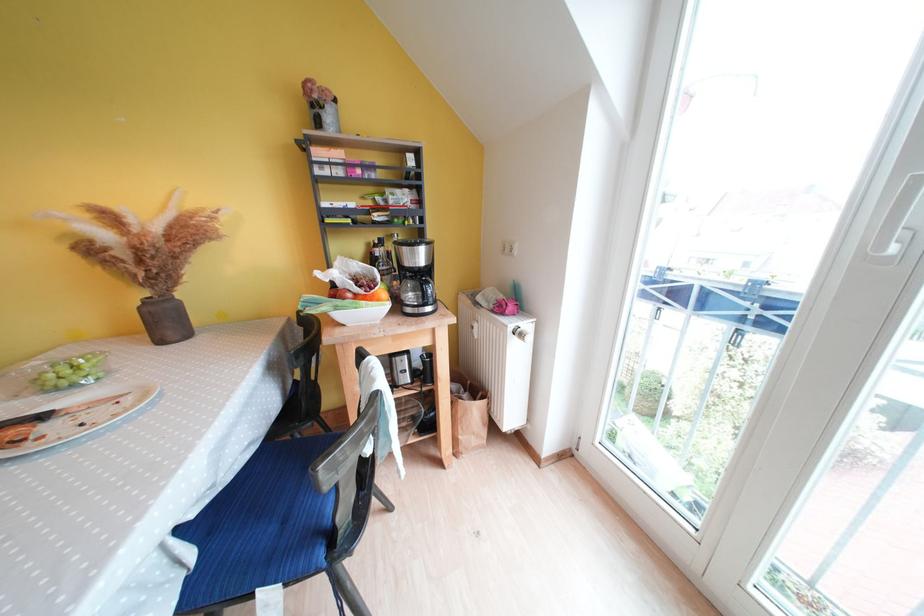
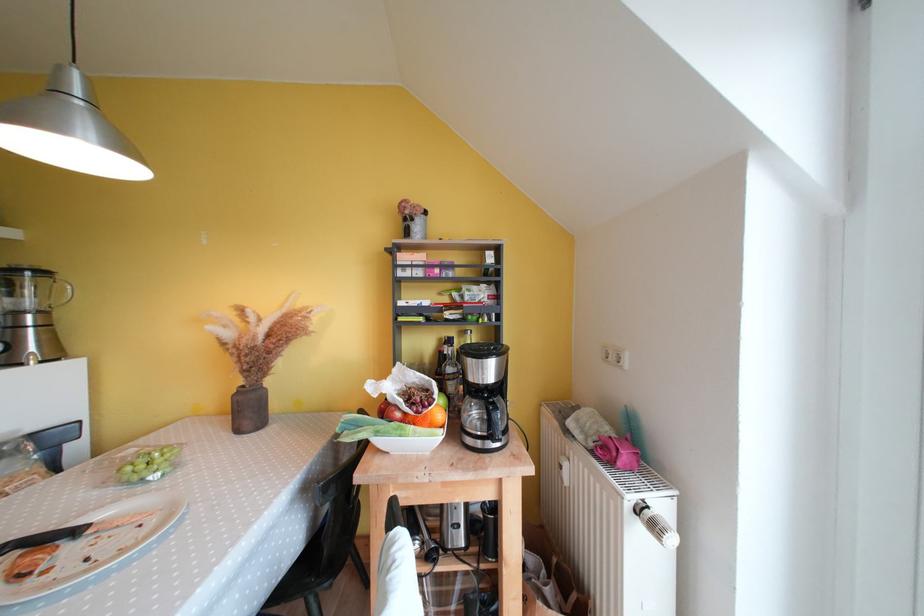
Locate, in the second image, the point that corresponds to pixel 374 248 in the first image.

(446, 342)